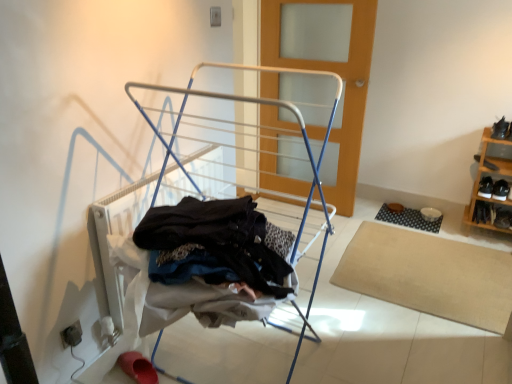
I want to click on free space between wooden shoe rack at right and beige carpet at lower right, the first mat from the front, so click(429, 220).